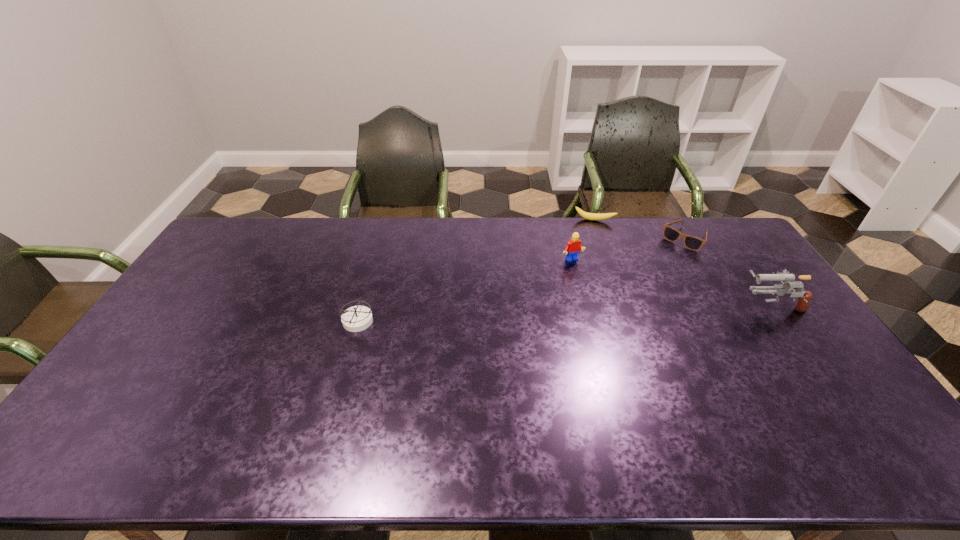
I want to click on vacant space on the desktop that is between the compass and the tallest object and is positioned on the front-facing side of the fourth object from right to left, so click(x=611, y=312).

The height and width of the screenshot is (540, 960). I want to click on vacant spot on the desktop that is between the compass and the gun and is positioned on the upward curve of the banana, so click(x=591, y=312).

I want to click on vacant spot on the desktop that is between the leftmost object and the gun and is positioned on the frames of the sunglasses, so click(x=615, y=312).